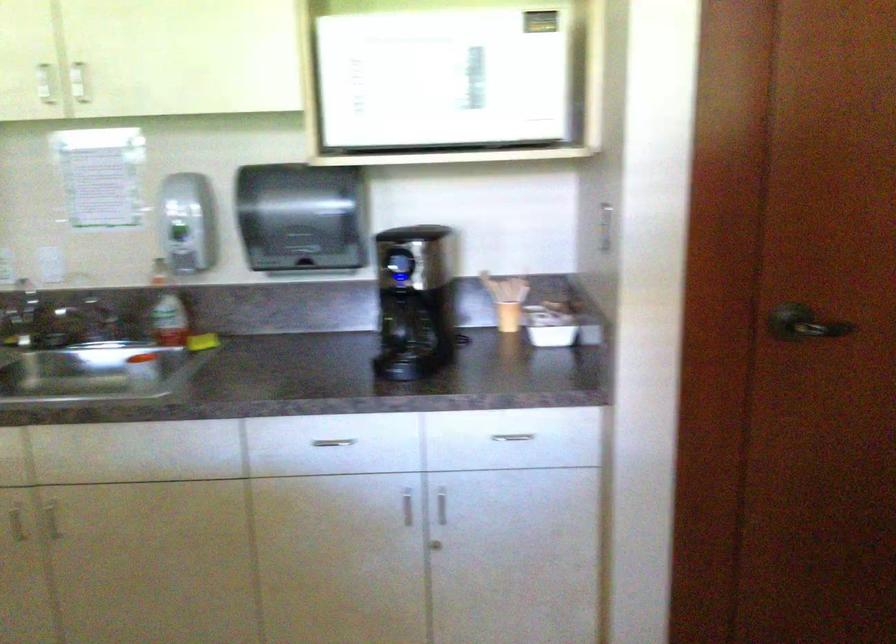
Find where to push the soap dispenser button. Please return your answer as a coordinate pair (x, y).

(159, 272)